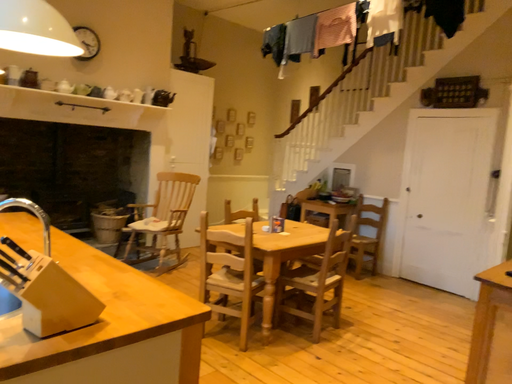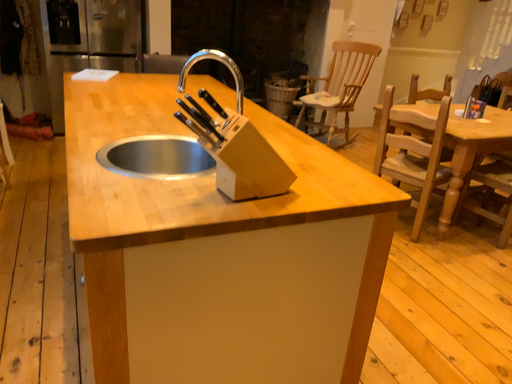
Question: Which way did the camera rotate in the video?

Choices:
 (A) rotated upward
 (B) rotated downward

Answer: (B)